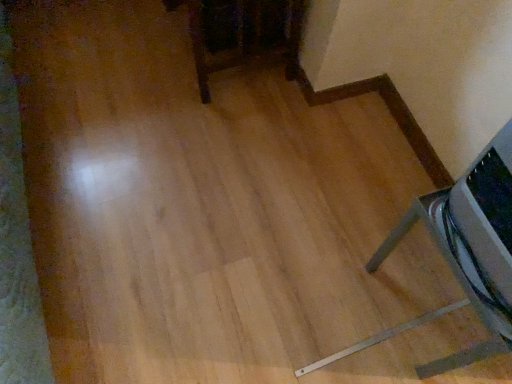
The width and height of the screenshot is (512, 384). What are the coordinates of `free space below metallic silver speaker at lower right, arranged as the first furniture when viewed from the right (from a real-world perspective)` in the screenshot? It's located at (433, 305).